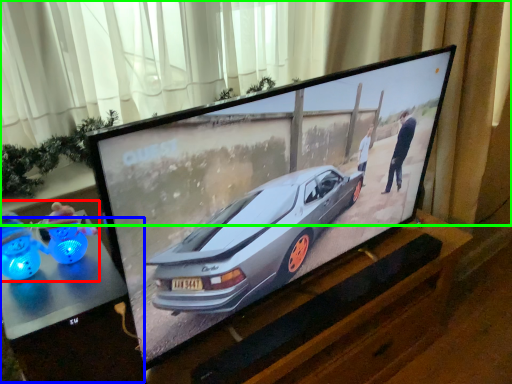
Question: Which is farther away from toy (highlighted by a red box)? table (highlighted by a blue box) or curtain (highlighted by a green box)?

Choices:
 (A) table
 (B) curtain

Answer: (B)